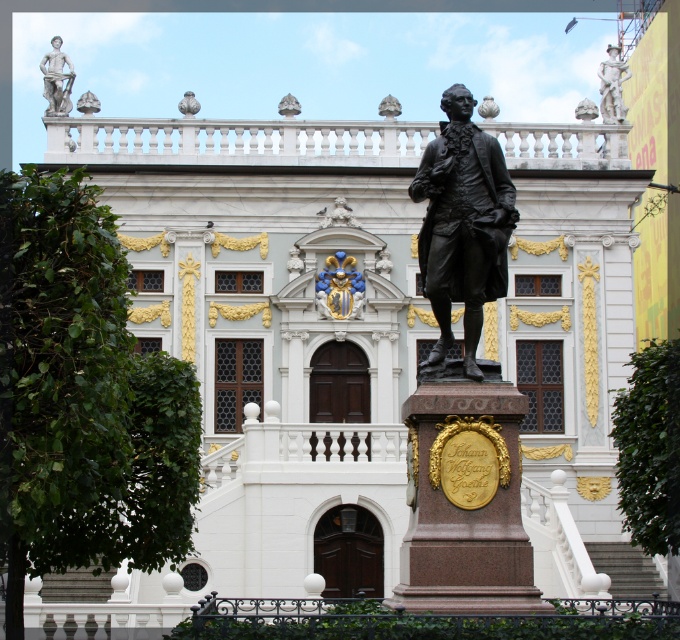
Question: Is bronze statue at center further to camera compared to bronze statue at upper right?

Choices:
 (A) no
 (B) yes

Answer: (A)

Question: Which point is farther from the camera taking this photo?

Choices:
 (A) (426, 289)
 (B) (609, 106)

Answer: (B)

Question: Is white marble statue at upper left closer to camera compared to bronze statue at upper right?

Choices:
 (A) yes
 (B) no

Answer: (A)

Question: Is bronze statue at center wider than gold and blue shield at center?

Choices:
 (A) yes
 (B) no

Answer: (A)

Question: Considering the real-world distances, which object is closest to the bronze statue at upper right?

Choices:
 (A) bronze statue at center
 (B) white marble statue at upper left

Answer: (B)

Question: Based on their relative distances, which object is nearer to the white marble statue at upper left?

Choices:
 (A) gold and blue shield at center
 (B) bronze statue at upper right

Answer: (A)